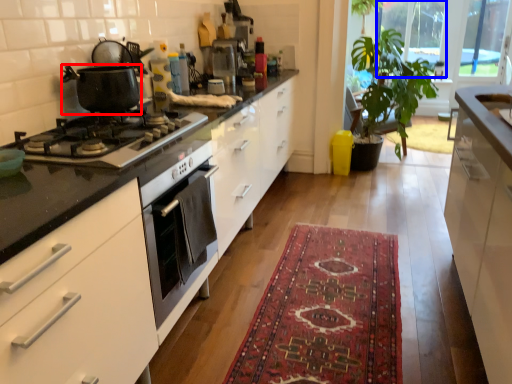
Question: Which object is further to the camera taking this photo, kitchen appliance (highlighted by a red box) or window screen (highlighted by a blue box)?

Choices:
 (A) kitchen appliance
 (B) window screen

Answer: (B)